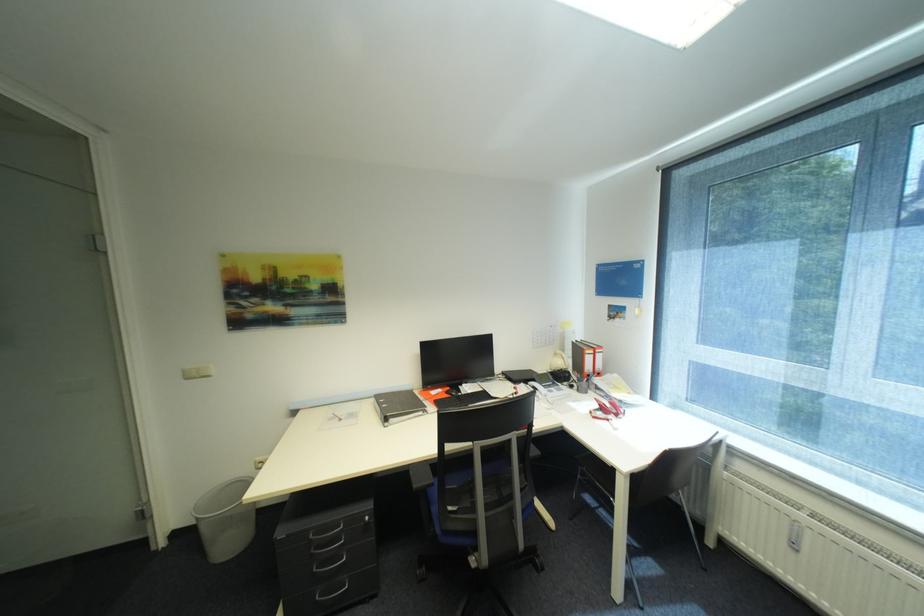
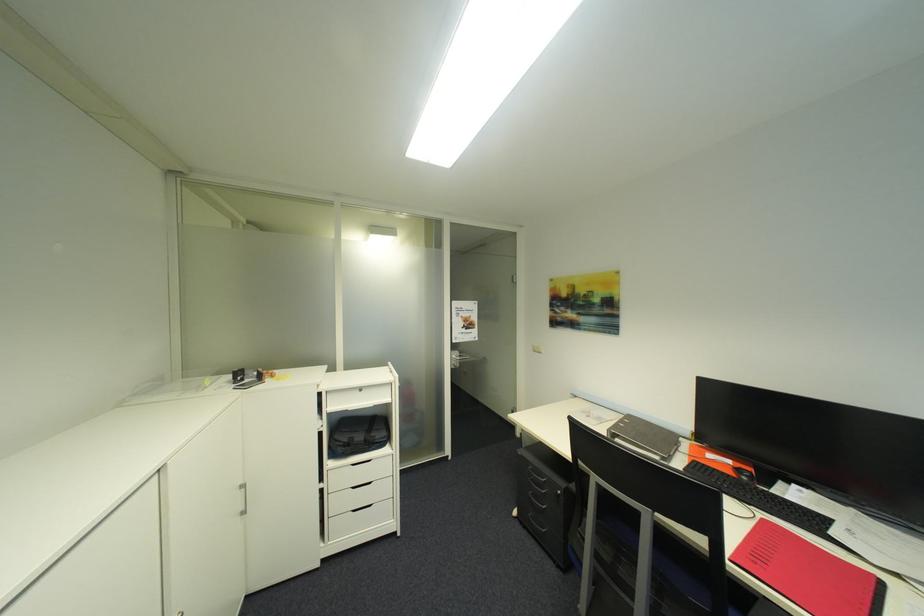
Find the pixel in the second image that matches [447,391] in the first image.

(736, 463)